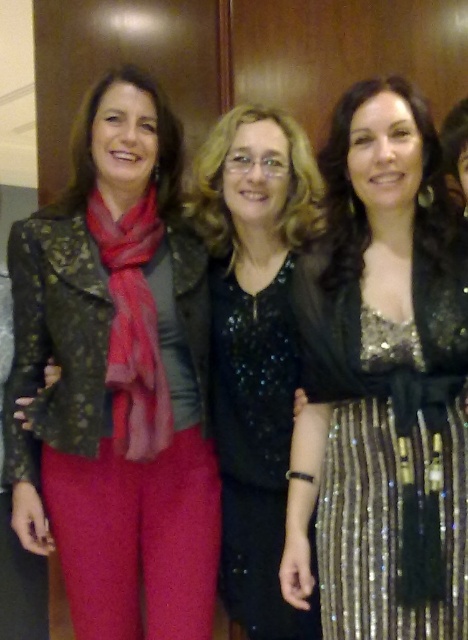
You are standing in the image and want to take a photo of the point at coordinate (204, 513). If your camera has a focal length of 50mm and you are currently 2 meters away from the point, should you move closer or farther away to focus properly?

The point at coordinate (204, 513) is 1.57 meters from the camera. Since you are currently 2 meters away, you need to move closer to 1.57 meters to focus properly.

You are organizing a charity event and need to display two items on a shelf. The items are the matte black jacket at left and the black sequined dress at center. The shelf has limited space. Based on their sizes, which item should you place first to ensure both fit properly?

The matte black jacket at left is bigger than the black sequined dress at center, so you should place the matte black jacket at left first to accommodate its larger size before placing the black sequined dress at center.